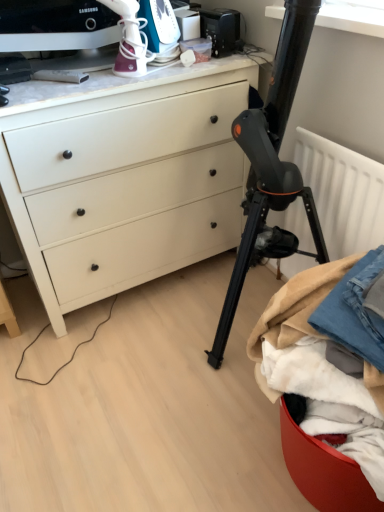
Question: Is matte white chest of drawers at upper left in contact with denim fabric at lower right, placed as the 2th clothing when sorted from right to left?

Choices:
 (A) yes
 (B) no

Answer: (B)

Question: Is matte white chest of drawers at upper left completely or partially outside of denim fabric at lower right, acting as the 1th clothing starting from the left?

Choices:
 (A) no
 (B) yes

Answer: (B)

Question: Is matte white chest of drawers at upper left wider than denim fabric at lower right, placed as the 2th clothing when sorted from right to left?

Choices:
 (A) no
 (B) yes

Answer: (B)

Question: From a real-world perspective, is matte white chest of drawers at upper left below denim fabric at lower right, placed as the 2th clothing when sorted from right to left?

Choices:
 (A) yes
 (B) no

Answer: (B)

Question: Can you confirm if matte white chest of drawers at upper left is smaller than denim fabric at lower right, acting as the 1th clothing starting from the left?

Choices:
 (A) no
 (B) yes

Answer: (A)

Question: Considering the positions of matte white chest of drawers at upper left and black plastic toaster at upper center, which ranks as the 2th appliance in left-to-right order, in the image, is matte white chest of drawers at upper left taller or shorter than black plastic toaster at upper center, which ranks as the 2th appliance in left-to-right order,?

Choices:
 (A) tall
 (B) short

Answer: (A)

Question: Considering the positions of matte white chest of drawers at upper left and black plastic toaster at upper center, the first appliance in the right-to-left sequence, in the image, is matte white chest of drawers at upper left bigger or smaller than black plastic toaster at upper center, the first appliance in the right-to-left sequence,?

Choices:
 (A) small
 (B) big

Answer: (B)

Question: Is matte white chest of drawers at upper left to the left or to the right of black plastic toaster at upper center, which ranks as the 2th appliance in left-to-right order, in the image?

Choices:
 (A) right
 (B) left

Answer: (B)

Question: Is matte white chest of drawers at upper left wider or thinner than black plastic toaster at upper center, the first appliance in the right-to-left sequence?

Choices:
 (A) thin
 (B) wide

Answer: (B)

Question: Is denim fabric at lower right, placed as the 2th clothing when sorted from right to left, taller or shorter than white textured radiator at right?

Choices:
 (A) short
 (B) tall

Answer: (A)

Question: From the image's perspective, relative to white textured radiator at right, is denim fabric at lower right, acting as the 1th clothing starting from the left, above or below?

Choices:
 (A) below
 (B) above

Answer: (A)

Question: In the image, is denim fabric at lower right, placed as the 2th clothing when sorted from right to left, on the left side or the right side of white textured radiator at right?

Choices:
 (A) left
 (B) right

Answer: (A)

Question: Relative to white textured radiator at right, is denim fabric at lower right, placed as the 2th clothing when sorted from right to left, in front or behind?

Choices:
 (A) front
 (B) behind

Answer: (A)

Question: Relative to denim fabric at lower right, placed as the 2th clothing when sorted from right to left, is white plastic iron at upper center, positioned as the second appliance in right-to-left order, in front or behind?

Choices:
 (A) front
 (B) behind

Answer: (B)

Question: Considering the positions of white plastic iron at upper center, positioned as the second appliance in right-to-left order, and denim fabric at lower right, placed as the 2th clothing when sorted from right to left, in the image, is white plastic iron at upper center, positioned as the second appliance in right-to-left order, taller or shorter than denim fabric at lower right, placed as the 2th clothing when sorted from right to left,?

Choices:
 (A) short
 (B) tall

Answer: (A)